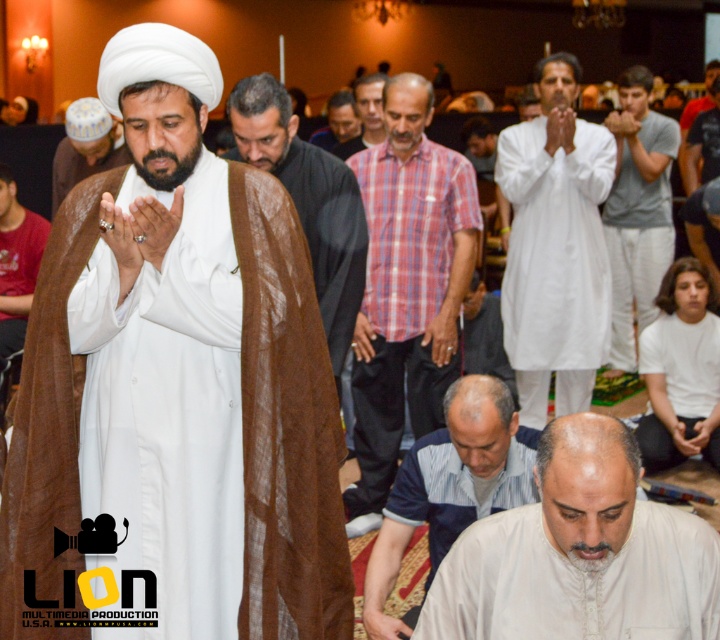
From the picture: Which is more to the left, white cotton shirt at lower right or light brown shirt at center?

light brown shirt at center

Between point (711, 429) and point (372, 132), which one is positioned behind?

Positioned behind is point (372, 132).

Who is more forward, (x=654, y=458) or (x=364, y=116)?

Point (x=654, y=458) is more forward.

Locate an element on the screen. white cotton shirt at lower right is located at coordinates (684, 364).

Is brown fabric shawl at center below white matte turban at upper left?

Correct, brown fabric shawl at center is located below white matte turban at upper left.

Is point (359, 227) in front of point (120, 148)?

Yes, point (359, 227) is in front of point (120, 148).

The height and width of the screenshot is (640, 720). I want to click on brown fabric shawl at center, so click(x=307, y=200).

Identify the location of brown fabric shawl at center. The height and width of the screenshot is (640, 720). (307, 200).

Does point (333, 275) come closer to viewer compared to point (1, 339)?

Yes.

Is brown fabric shawl at center thinner than red shirt at left?

In fact, brown fabric shawl at center might be wider than red shirt at left.

This screenshot has height=640, width=720. What do you see at coordinates (307, 200) in the screenshot?
I see `brown fabric shawl at center` at bounding box center [307, 200].

Image resolution: width=720 pixels, height=640 pixels. I want to click on brown fabric shawl at center, so click(307, 200).